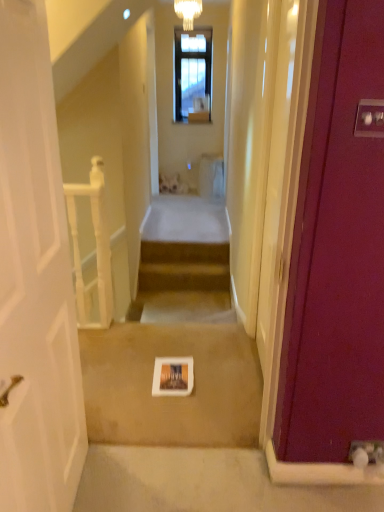
Question: Does white matte book at center have a greater height compared to white wooden balustrade at left?

Choices:
 (A) yes
 (B) no

Answer: (B)

Question: Is white matte book at center to the right of white wooden balustrade at left from the viewer's perspective?

Choices:
 (A) no
 (B) yes

Answer: (B)

Question: Is white matte book at center smaller than white wooden balustrade at left?

Choices:
 (A) yes
 (B) no

Answer: (B)

Question: Considering the relative positions of white matte book at center and white wooden balustrade at left in the image provided, is white matte book at center behind white wooden balustrade at left?

Choices:
 (A) no
 (B) yes

Answer: (A)

Question: From the image's perspective, would you say white matte book at center is shown under white wooden balustrade at left?

Choices:
 (A) no
 (B) yes

Answer: (B)

Question: Considering their positions, is white matte book at center located in front of or behind white glass chandelier at upper center?

Choices:
 (A) behind
 (B) front

Answer: (B)

Question: Based on their sizes in the image, would you say white matte book at center is bigger or smaller than white glass chandelier at upper center?

Choices:
 (A) small
 (B) big

Answer: (B)

Question: From the image's perspective, is white matte book at center located above or below white glass chandelier at upper center?

Choices:
 (A) below
 (B) above

Answer: (A)

Question: From a real-world perspective, relative to white glass chandelier at upper center, is white matte book at center vertically above or below?

Choices:
 (A) below
 (B) above

Answer: (A)

Question: In terms of width, does white glass chandelier at upper center look wider or thinner when compared to white matte book at center?

Choices:
 (A) thin
 (B) wide

Answer: (A)

Question: From the image's perspective, is white glass chandelier at upper center located above or below white matte book at center?

Choices:
 (A) above
 (B) below

Answer: (A)

Question: In the image, is white glass chandelier at upper center positioned in front of or behind white matte book at center?

Choices:
 (A) front
 (B) behind

Answer: (B)

Question: From a real-world perspective, is white glass chandelier at upper center positioned above or below white matte book at center?

Choices:
 (A) below
 (B) above

Answer: (B)

Question: Relative to white wooden balustrade at left, is white glass chandelier at upper center in front or behind?

Choices:
 (A) behind
 (B) front

Answer: (A)

Question: From the image's perspective, is white glass chandelier at upper center located above or below white wooden balustrade at left?

Choices:
 (A) above
 (B) below

Answer: (A)